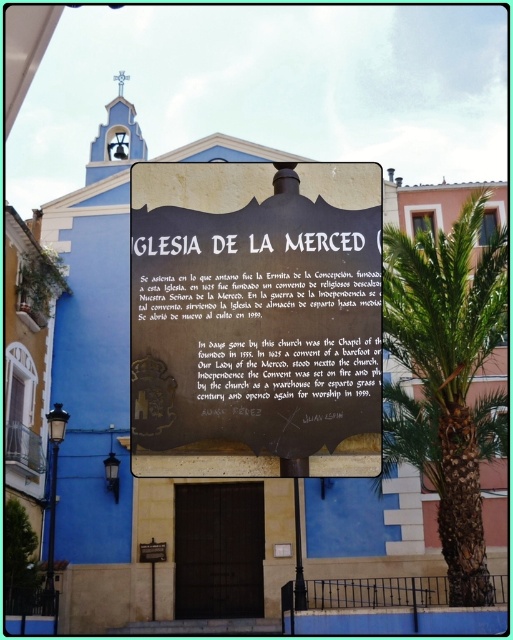
You are a city planner assessing the space between the black polished stone sign at center and the green leafy palm tree at right. The city wants to install a bench that is 2 meters long between them. Is there enough space for the bench?

The black polished stone sign at center and green leafy palm tree at right are 18.55 meters apart, so yes, there is enough space for a 2 meter long bench between them.

You are a tour guide leading a group to the Iglesia de la Merced. You want to ensure your visitors can easily read both the black polished stone sign at center and the metallic plaque at lower center. Since you have a limited time, which object should you address first to ensure it fits within your explanation without overcrowding the space?

The black polished stone sign at center has a larger width than the metallic plaque at lower center, so you should address the black polished stone sign at center first as it requires more space for explanation.

Looking at this image, you are standing at the entrance of Iglesia de la Merced and want to take a photo of the historical sign mentioned in the scene. You have a camera with a focal length of 50mm. The sign is located at point (460, 506) in the image coordinates. If the distance from the camera to the sign is 188.02 feet, what is the angular size of the sign in degrees?

The angular size can be calculated using the formula angular size in degrees equals the focal length divided by the distance multiplied by 57.3. Plugging in the values, 50mm divided by 188.02 feet multiplied by 57.3 gives approximately 1.5 degrees. Therefore, the angular size of the sign is approximately 1.5 degrees.